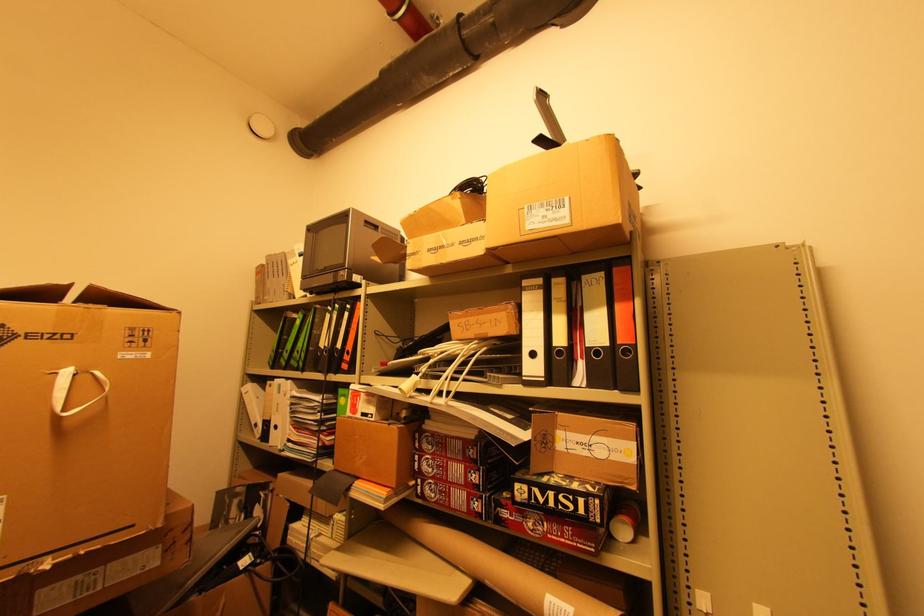
I want to click on white box handle, so click(x=74, y=390).